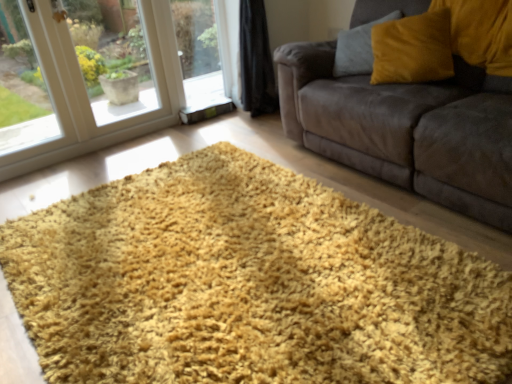
What do you see at coordinates (104, 94) in the screenshot? I see `transparent glass window at lower left` at bounding box center [104, 94].

In order to face velvet brown couch at center, should I rotate leftwards or rightwards?

A 21.841 degree turn to the right will do.

Describe the element at coordinates (413, 49) in the screenshot. I see `velvet yellow pillow at upper right` at that location.

I want to click on transparent glass window at lower left, so click(104, 94).

Considering the relative sizes of yellow shaggy rug at center and velvet yellow pillow at upper right in the image provided, is yellow shaggy rug at center taller than velvet yellow pillow at upper right?

No, yellow shaggy rug at center is not taller than velvet yellow pillow at upper right.

Who is bigger, yellow shaggy rug at center or velvet yellow pillow at upper right?

A: yellow shaggy rug at center is bigger.

Locate an element on the screen. The width and height of the screenshot is (512, 384). hay located in front of the velvet yellow pillow at upper right is located at coordinates (248, 284).

Is yellow shaggy rug at center surrounding velvet yellow pillow at upper right?

No, velvet yellow pillow at upper right is not a part of yellow shaggy rug at center.

This screenshot has height=384, width=512. Find the location of `window behind the velvet brown couch at center`. window behind the velvet brown couch at center is located at coordinates (104, 94).

Considering the sizes of objects transparent glass window at lower left and velvet brown couch at center in the image provided, who is thinner, transparent glass window at lower left or velvet brown couch at center?

transparent glass window at lower left is thinner.

From the image's perspective, between transparent glass window at lower left and velvet brown couch at center, who is located below?

From the image's view, velvet brown couch at center is below.

Considering the relative sizes of transparent glass window at lower left and velvet brown couch at center in the image provided, is transparent glass window at lower left shorter than velvet brown couch at center?

In fact, transparent glass window at lower left may be taller than velvet brown couch at center.

Is velvet yellow pillow at upper right situated inside yellow shaggy rug at center or outside?

velvet yellow pillow at upper right is not inside yellow shaggy rug at center, it's outside.

How different are the orientations of velvet yellow pillow at upper right and yellow shaggy rug at center in degrees?

They differ by 36.6 degrees in their facing directions.

Is velvet yellow pillow at upper right looking in the opposite direction of yellow shaggy rug at center?

velvet yellow pillow at upper right does not have its back to yellow shaggy rug at center.

I want to click on hay directly beneath the velvet yellow pillow at upper right (from a real-world perspective), so click(248, 284).

Is yellow shaggy rug at center with transparent glass window at lower left?

There is a gap between yellow shaggy rug at center and transparent glass window at lower left.

Would you say yellow shaggy rug at center contains transparent glass window at lower left?

Actually, transparent glass window at lower left is outside yellow shaggy rug at center.

Visually, is yellow shaggy rug at center positioned to the left or to the right of transparent glass window at lower left?

Answer: From the image, it's evident that yellow shaggy rug at center is to the right of transparent glass window at lower left.

Looking at this image, is transparent glass window at lower left positioned behind yellow shaggy rug at center?

Yes, it is behind yellow shaggy rug at center.

From a real-world perspective, which is physically above, transparent glass window at lower left or yellow shaggy rug at center?

From a 3D spatial view, transparent glass window at lower left is above.

Is yellow shaggy rug at center located within transparent glass window at lower left?

No, yellow shaggy rug at center is not inside transparent glass window at lower left.

From the image's perspective, is transparent glass window at lower left on top of yellow shaggy rug at center?

Yes, from the image's perspective, transparent glass window at lower left is above yellow shaggy rug at center.

Between velvet brown couch at center and yellow shaggy rug at center, which one has more height?

With more height is velvet brown couch at center.

Is velvet brown couch at center thinner than yellow shaggy rug at center?

Correct, the width of velvet brown couch at center is less than that of yellow shaggy rug at center.

How many degrees apart are the facing directions of velvet brown couch at center and yellow shaggy rug at center?

velvet brown couch at center and yellow shaggy rug at center are facing 4.75e-05 degrees away from each other.

Does velvet brown couch at center turn towards yellow shaggy rug at center?

Yes, velvet brown couch at center is turned towards yellow shaggy rug at center.

From the image's perspective, is yellow shaggy rug at center beneath velvet brown couch at center?

Indeed, from the image's perspective, yellow shaggy rug at center is shown beneath velvet brown couch at center.

What are the coordinates of `studio couch behind the yellow shaggy rug at center` in the screenshot? It's located at (406, 128).

Is point (510, 354) positioned behind point (391, 119)?

No, (510, 354) is in front of (391, 119).

Locate an element on the screen. The width and height of the screenshot is (512, 384). throw pillow above the yellow shaggy rug at center (from the image's perspective) is located at coordinates (x=413, y=49).

The width and height of the screenshot is (512, 384). Find the location of `studio couch below the transparent glass window at lower left (from a real-world perspective)`. studio couch below the transparent glass window at lower left (from a real-world perspective) is located at coordinates 406,128.

Which object lies further to the anchor point yellow shaggy rug at center, transparent glass window at lower left or velvet brown couch at center?

transparent glass window at lower left.

Estimate the real-world distances between objects in this image. Which object is closer to velvet yellow pillow at upper right, transparent glass window at lower left or velvet brown couch at center?

velvet brown couch at center.

From the image, which object appears to be farther from velvet brown couch at center, transparent glass window at lower left or velvet yellow pillow at upper right?

transparent glass window at lower left is positioned further to the anchor velvet brown couch at center.

Looking at the image, which one is located further to velvet brown couch at center, yellow shaggy rug at center or transparent glass window at lower left?

Result: transparent glass window at lower left.

Estimate the real-world distances between objects in this image. Which object is closer to velvet brown couch at center, transparent glass window at lower left or yellow shaggy rug at center?

The object closer to velvet brown couch at center is yellow shaggy rug at center.

Which object lies further to the anchor point velvet yellow pillow at upper right, velvet brown couch at center or transparent glass window at lower left?

Based on the image, transparent glass window at lower left appears to be further to velvet yellow pillow at upper right.

Which object lies nearer to the anchor point velvet brown couch at center, yellow shaggy rug at center or velvet yellow pillow at upper right?

velvet yellow pillow at upper right is closer to velvet brown couch at center.

Considering their positions, is yellow shaggy rug at center positioned further to transparent glass window at lower left than velvet brown couch at center?

Based on the image, yellow shaggy rug at center appears to be further to transparent glass window at lower left.

Find the location of a particular element. This screenshot has height=384, width=512. hay between transparent glass window at lower left and velvet yellow pillow at upper right in the horizontal direction is located at coordinates (248, 284).

This screenshot has height=384, width=512. I want to click on hay located between transparent glass window at lower left and velvet brown couch at center in the left-right direction, so click(x=248, y=284).

The image size is (512, 384). Identify the location of studio couch between yellow shaggy rug at center and velvet yellow pillow at upper right from front to back. (406, 128).

In order to click on throw pillow located between transparent glass window at lower left and velvet brown couch at center in the left-right direction in this screenshot , I will do `click(413, 49)`.